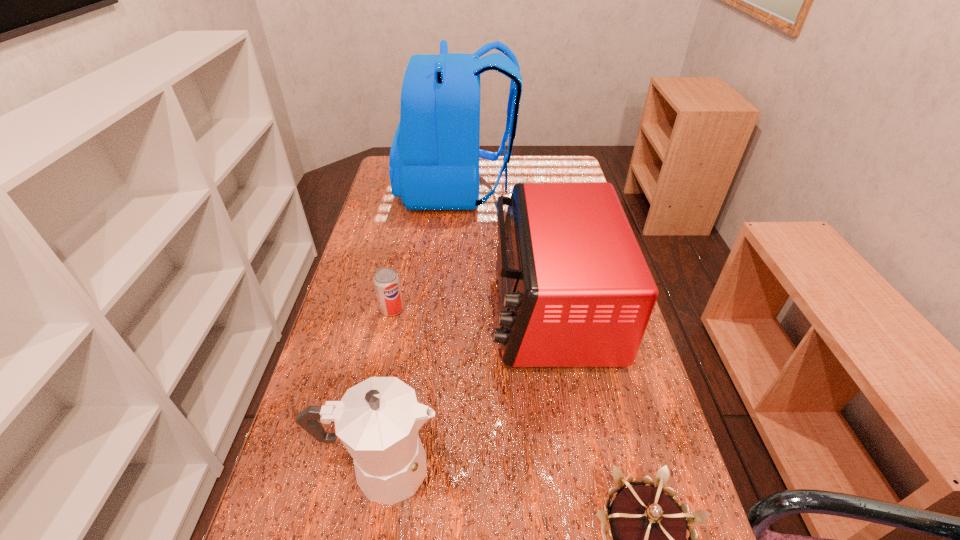
Locate an element on the screen. The width and height of the screenshot is (960, 540). vacant position located on the front of the soda is located at coordinates (366, 436).

The image size is (960, 540). Find the location of `object that is at the far edge`. object that is at the far edge is located at coordinates (434, 159).

Find the location of a particular element. backpack present at the left edge is located at coordinates (434, 159).

Where is `coffeepot positioned at the left edge`? The width and height of the screenshot is (960, 540). coffeepot positioned at the left edge is located at coordinates (377, 420).

Locate an element on the screen. The width and height of the screenshot is (960, 540). soda positioned at the left edge is located at coordinates (386, 281).

This screenshot has height=540, width=960. What are the coordinates of `object that is at the right edge` in the screenshot? It's located at (575, 290).

You are a GUI agent. You are given a task and a screenshot of the screen. Output one action in this format:
    pyautogui.click(x=<x>, y=<y>)
    Task: Click on the object that is at the far left corner
    The width and height of the screenshot is (960, 540).
    Given the screenshot: What is the action you would take?
    pyautogui.click(x=434, y=159)

The height and width of the screenshot is (540, 960). Identify the location of vacant space at the far edge. (483, 172).

Where is `vacant space at the left edge of the desktop`? vacant space at the left edge of the desktop is located at coordinates (304, 453).

Where is `free location at the right edge of the desktop`? free location at the right edge of the desktop is located at coordinates (627, 414).